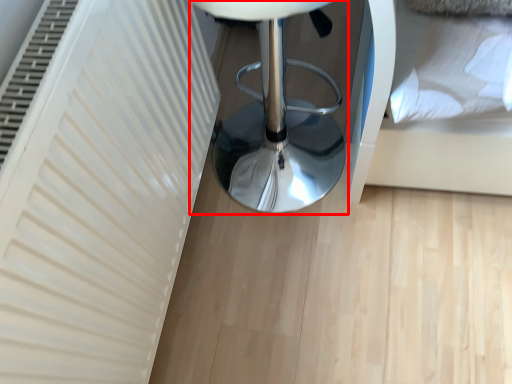
Question: Considering the relative positions of furniture (annotated by the red box) and bed in the image provided, where is furniture (annotated by the red box) located with respect to the staircase?

Choices:
 (A) left
 (B) right

Answer: (A)